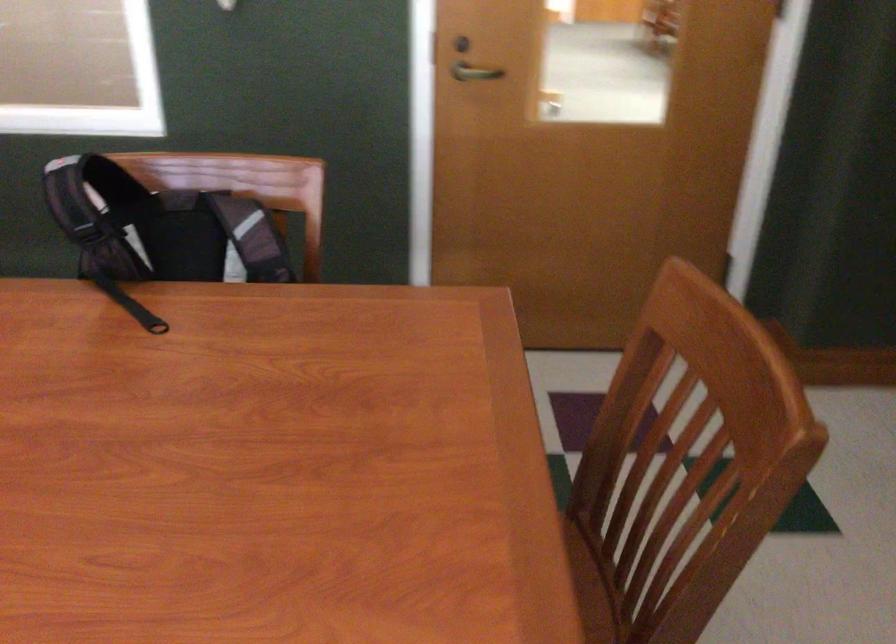
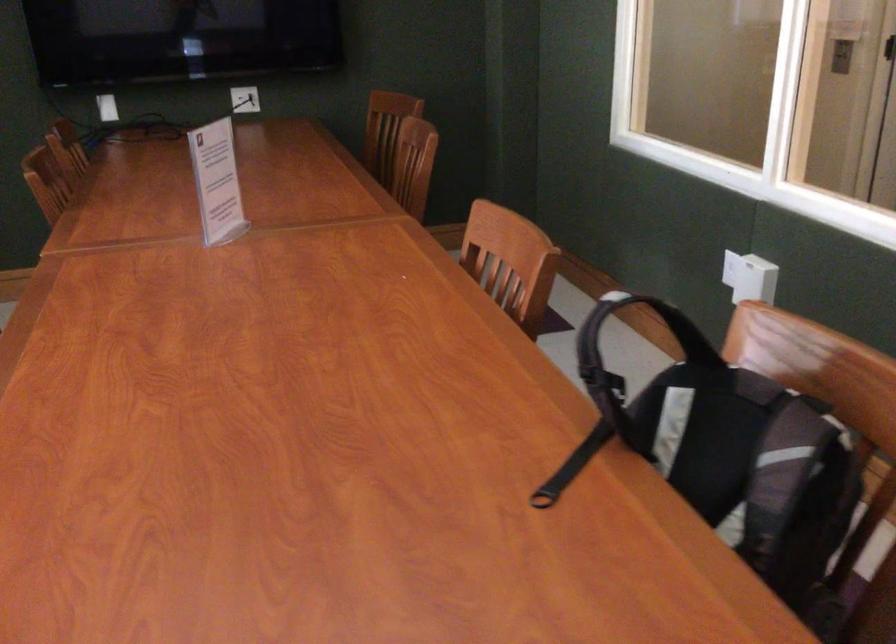
Find the pixel in the second image that matches (x=117, y=184) in the first image.

(690, 337)